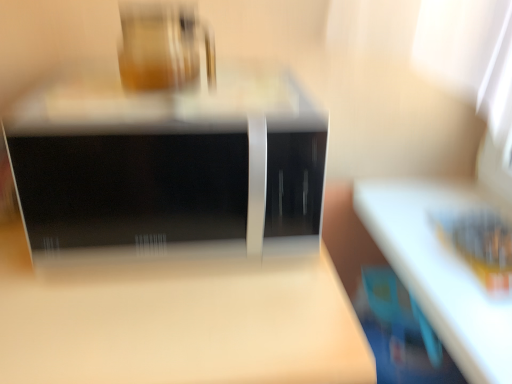
Find the location of a particular element. The height and width of the screenshot is (384, 512). vacant region to the left of matte glass jar at upper center is located at coordinates (76, 105).